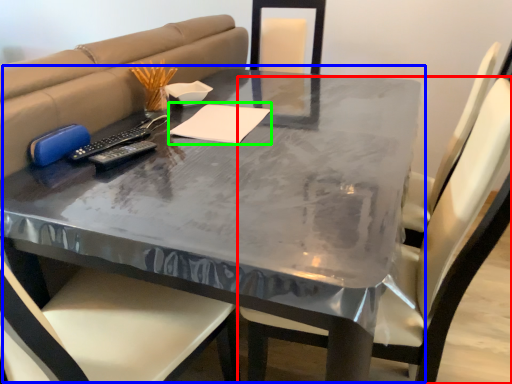
Question: Which is nearer to the chair (highlighted by a red box)? table (highlighted by a blue box) or notepad (highlighted by a green box).

Choices:
 (A) table
 (B) notepad

Answer: (A)